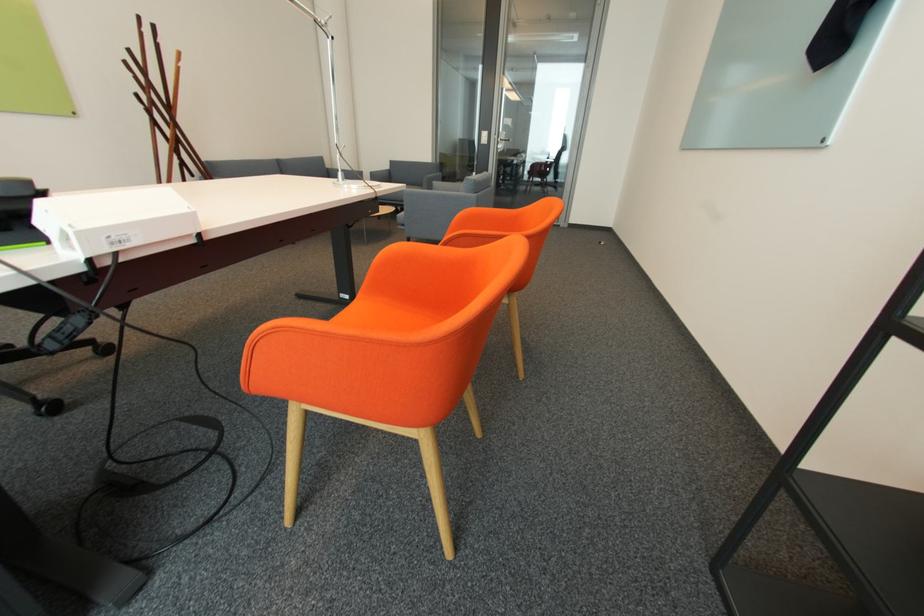
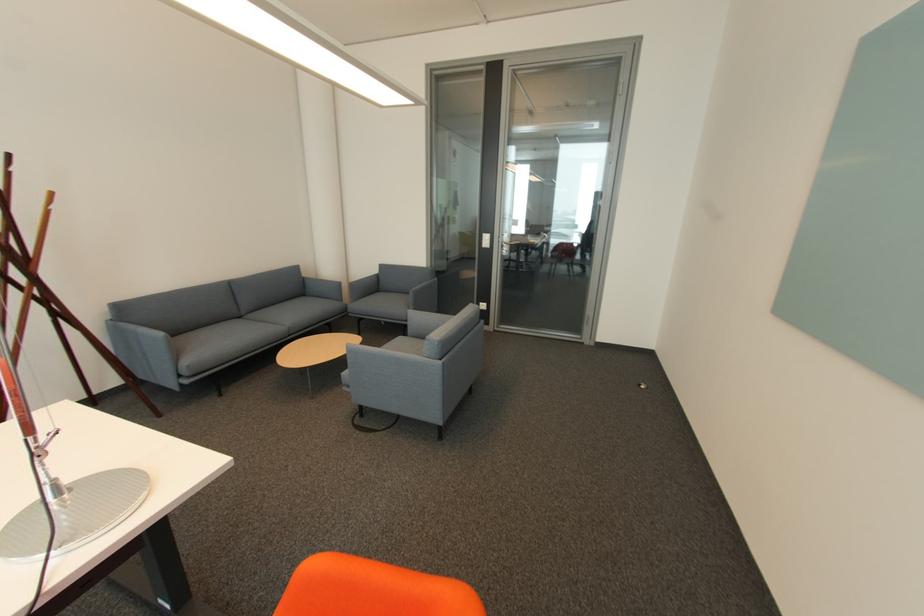
In the second image, find the point that corresponds to point 505,147 in the first image.

(508, 252)